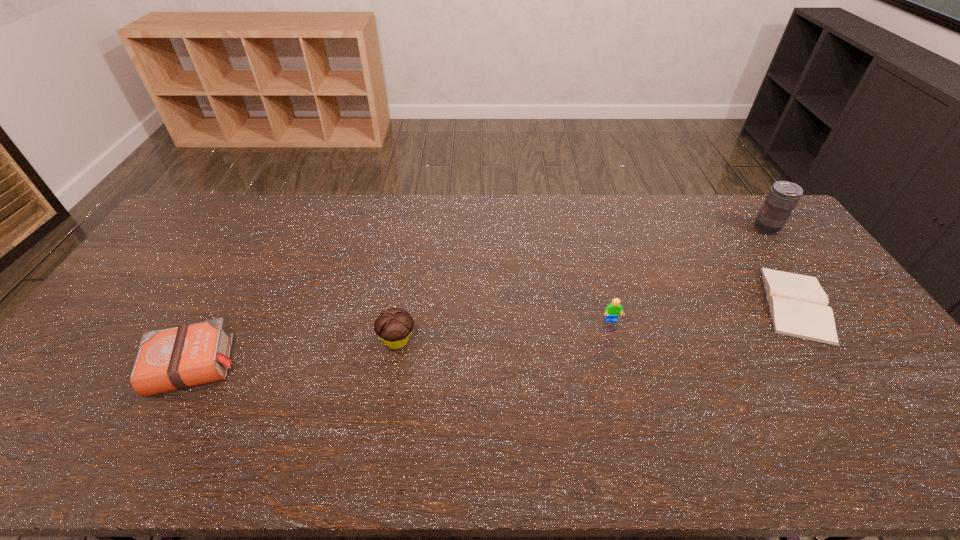
In order to click on vacant region between the third object from left to right and the shorter Bible in this screenshot , I will do `click(704, 312)`.

Where is `blank region between the shorter Bible and the Lego`? The width and height of the screenshot is (960, 540). blank region between the shorter Bible and the Lego is located at coordinates (704, 312).

Where is `free space between the farthest object and the left Bible`? free space between the farthest object and the left Bible is located at coordinates (479, 298).

The image size is (960, 540). I want to click on object that is the third nearest to the shortest object, so (394, 325).

In order to click on object that ranks as the third closest to the third object from left to right in this screenshot , I will do `click(783, 196)`.

The image size is (960, 540). In order to click on vacant space that satisfies the following two spatial constraints: 1. on the side of the telephoto lens where the control switches are located; 2. on the face of the third object from right to left in this screenshot , I will do `click(832, 321)`.

Image resolution: width=960 pixels, height=540 pixels. Identify the location of vacant region that satisfies the following two spatial constraints: 1. on the side of the telephoto lens where the control switches are located; 2. on the front side of the taller Bible. (866, 366).

Locate an element on the screen. The image size is (960, 540). vacant space that satisfies the following two spatial constraints: 1. on the side of the farthest object where the control switches are located; 2. on the face of the Lego is located at coordinates (832, 321).

Identify the location of free region that satisfies the following two spatial constraints: 1. on the side of the farthest object where the control switches are located; 2. on the front side of the shorter Bible. (820, 304).